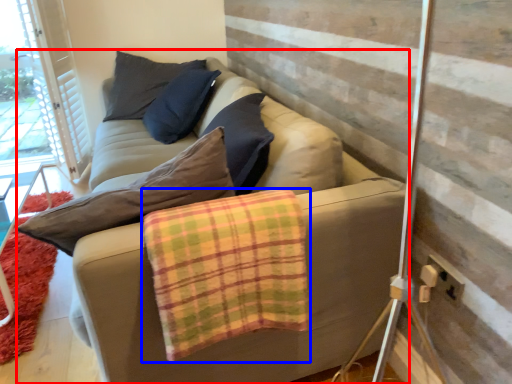
Question: Which point is further to the camera, studio couch (highlighted by a red box) or blanket (highlighted by a blue box)?

Choices:
 (A) studio couch
 (B) blanket

Answer: (B)